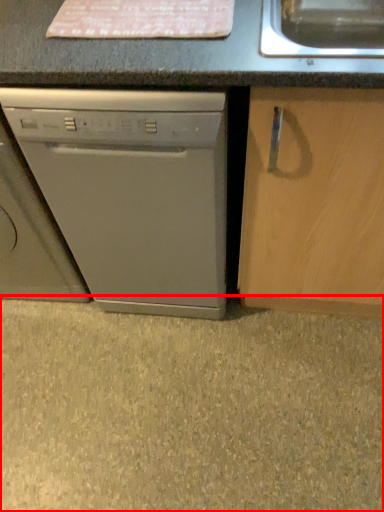
Question: From the image's perspective, where is concrete (annotated by the red box) located relative to washing machine?

Choices:
 (A) below
 (B) above

Answer: (A)